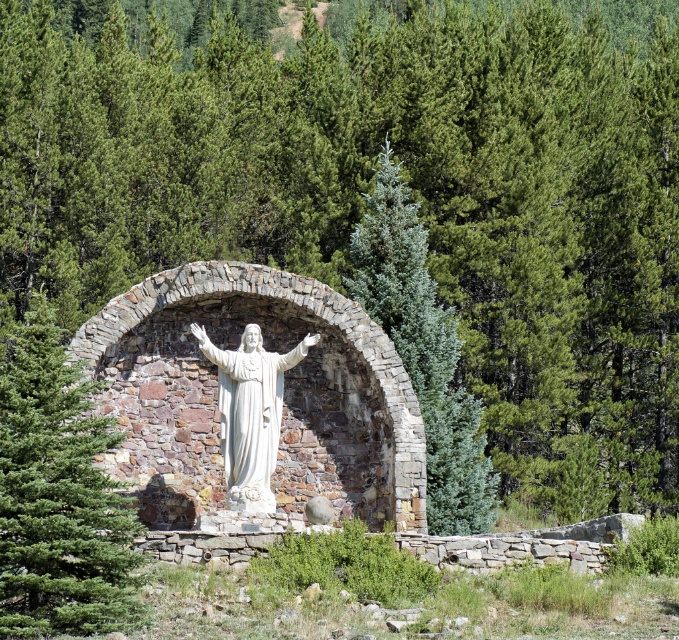
Question: Which of the following is the closest to the observer?

Choices:
 (A) [x=433, y=506]
 (B) [x=81, y=451]

Answer: (B)

Question: Among these objects, which one is nearest to the camera?

Choices:
 (A) green textured pine tree at center
 (B) green textured stone arch at center
 (C) white marble statue at center

Answer: (B)

Question: Is green textured stone arch at center wider than white marble statue at center?

Choices:
 (A) no
 (B) yes

Answer: (B)

Question: Does green textured pine tree at center have a greater width compared to white marble statue at center?

Choices:
 (A) no
 (B) yes

Answer: (B)

Question: Is green textured stone arch at center bigger than green textured pine tree at center?

Choices:
 (A) no
 (B) yes

Answer: (B)

Question: Which of these objects is positioned closest to the white marble statue at center?

Choices:
 (A) green textured pine tree at center
 (B) green textured stone arch at center

Answer: (B)